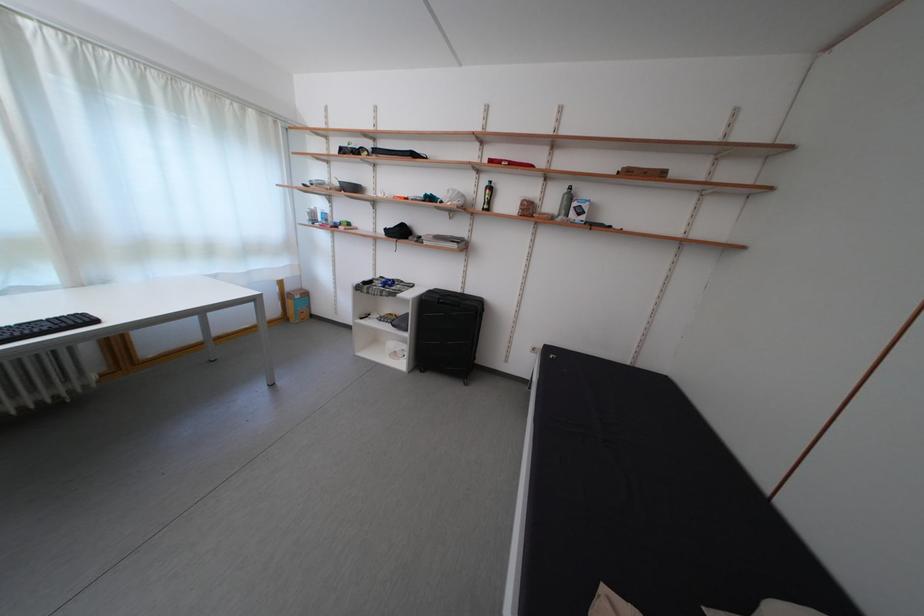
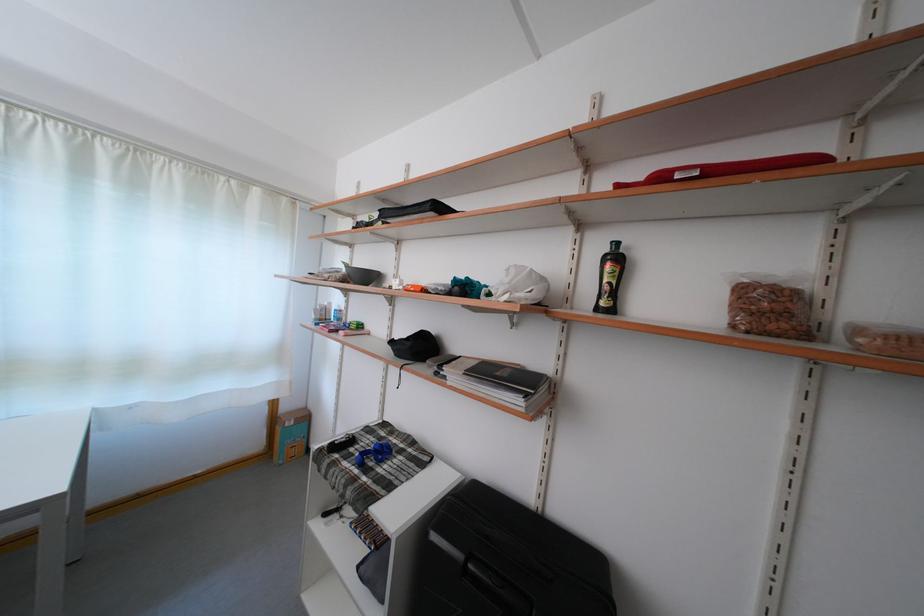
In the second image, find the point that corresponds to (x=464, y=251) in the first image.

(527, 408)